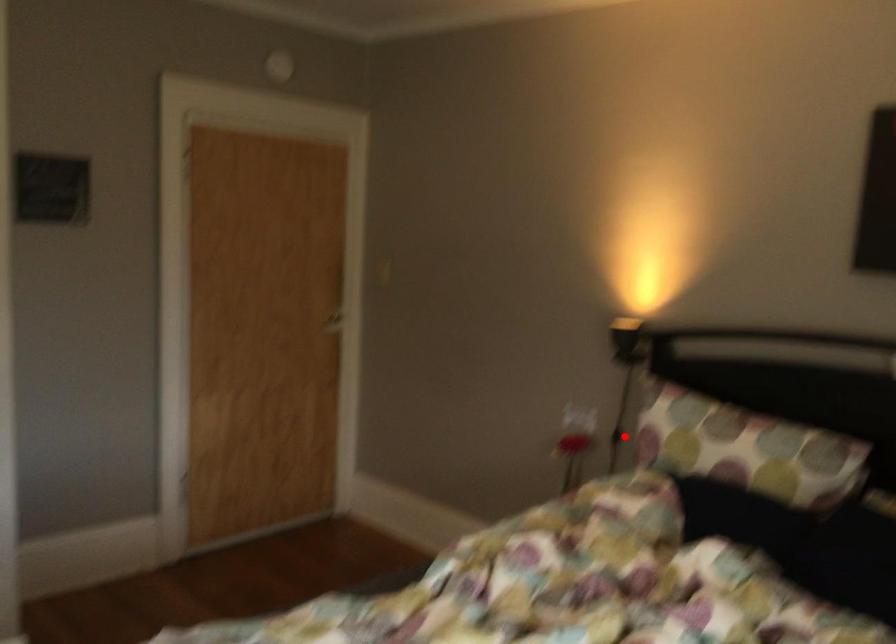
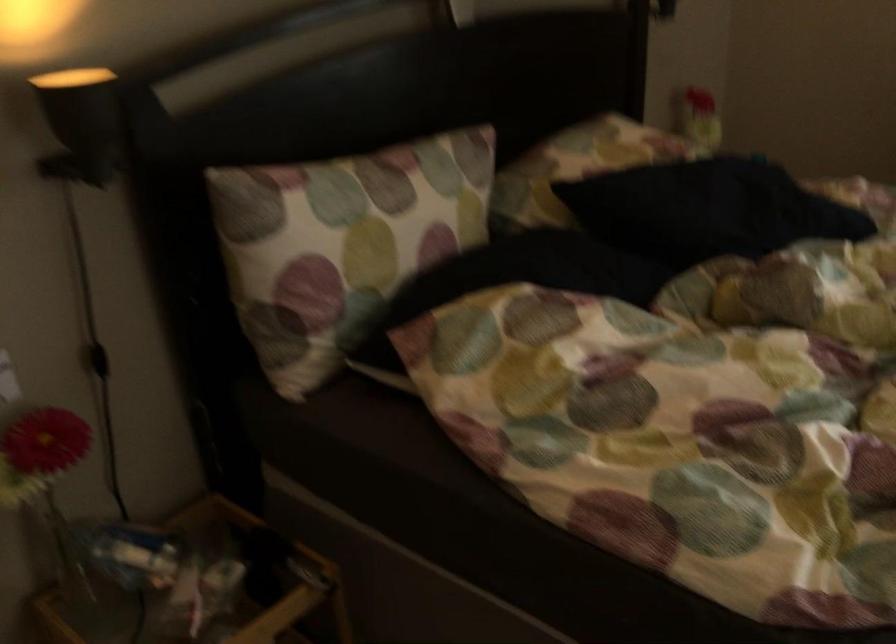
Question: I am providing you with two images of the same scene from different viewpoints. Given a red point in image1, look at the same physical point in image2. Is it:

Choices:
 (A) Closer to the viewpoint
 (B) Farther from the viewpoint

Answer: (A)